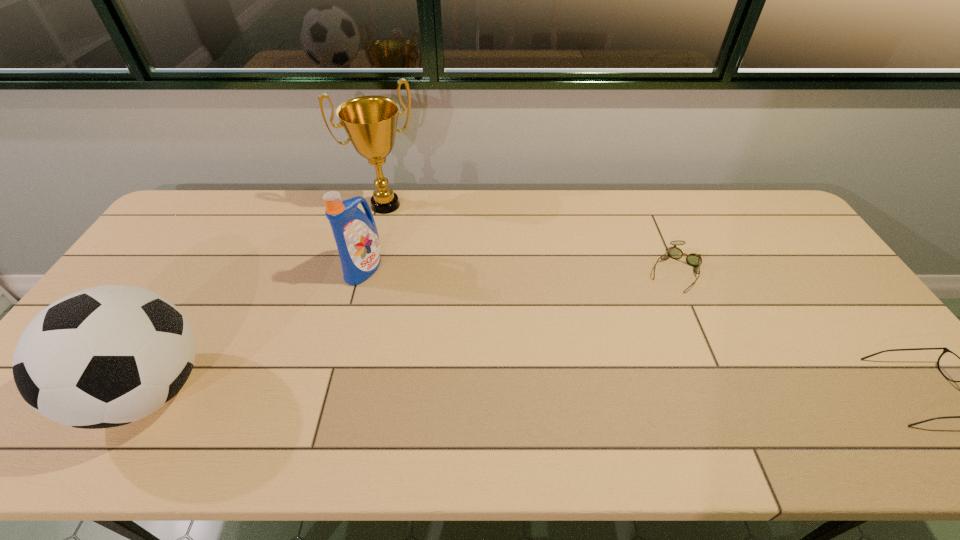
Identify the location of free space on the desktop that is between the leftmost object and the second shortest object and is positioned on the label of the detergent. (532, 391).

Identify the location of free space on the desktop that is between the leftmost object and the rightmost object and is positioned on the front-facing side of the shorter spectacles. tap(605, 391).

Where is `vacant space on the desktop that is between the leftmost object and the right spectacles and is positioned on the front view with handles of the farthest object`? The height and width of the screenshot is (540, 960). vacant space on the desktop that is between the leftmost object and the right spectacles and is positioned on the front view with handles of the farthest object is located at coordinates (488, 391).